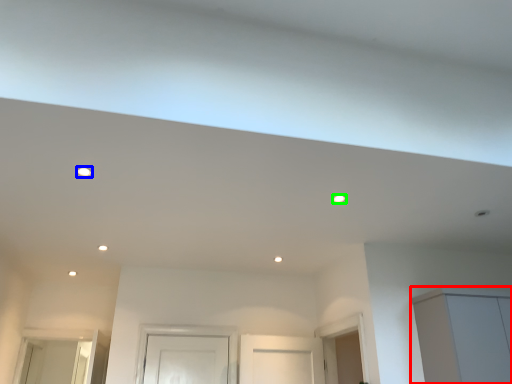
Question: Estimate the real-world distances between objects in this image. Which object is farther from cabinetry (highlighted by a red box), lighting (highlighted by a blue box) or lighting (highlighted by a green box)?

Choices:
 (A) lighting
 (B) lighting

Answer: (A)